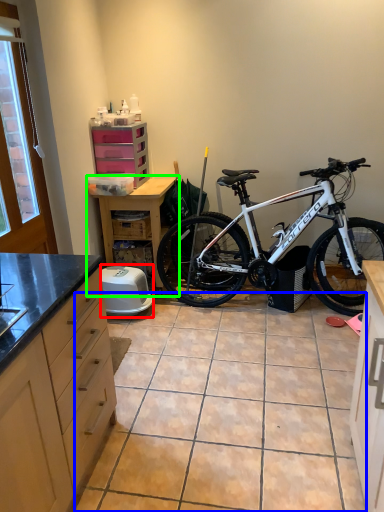
Question: Which is nearer to the appliance (highlighted by a red box)? tile (highlighted by a blue box) or table (highlighted by a green box).

Choices:
 (A) tile
 (B) table

Answer: (B)